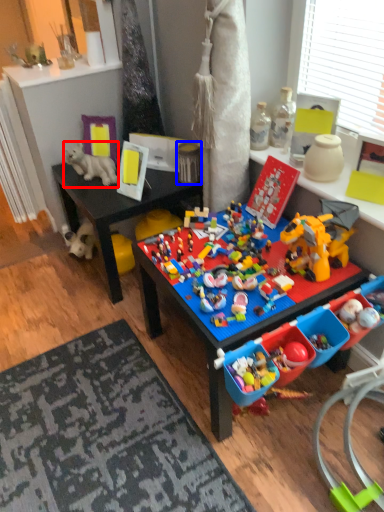
Question: Which object is further to the camera taking this photo, toy (highlighted by a red box) or toy (highlighted by a blue box)?

Choices:
 (A) toy
 (B) toy

Answer: (A)